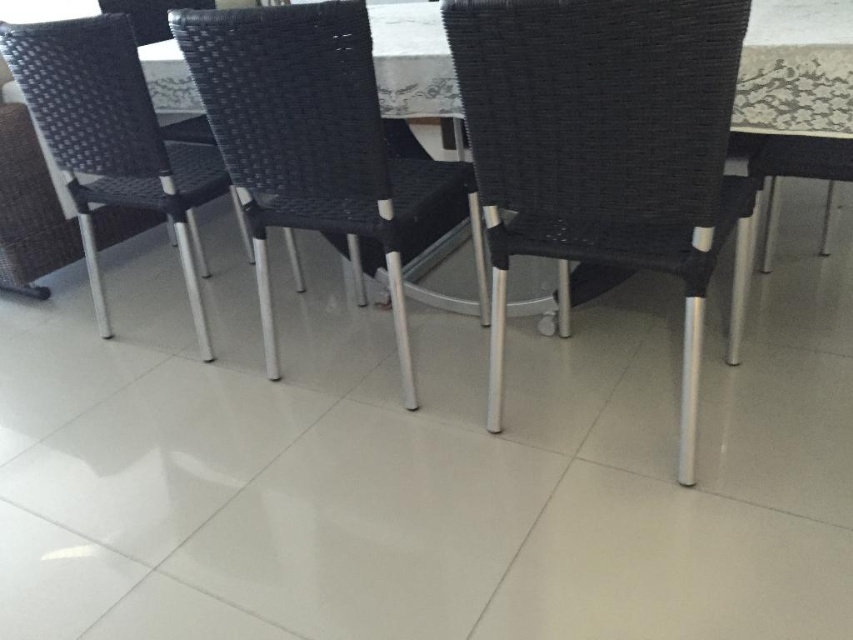
Question: Does matte black chair at center have a smaller size compared to black woven chair at upper right?

Choices:
 (A) yes
 (B) no

Answer: (B)

Question: Which of the following is the closest to the observer?

Choices:
 (A) (527, 76)
 (B) (846, 116)

Answer: (A)

Question: Can you confirm if black woven chair at center is positioned to the left of black woven chair at upper right?

Choices:
 (A) no
 (B) yes

Answer: (B)

Question: Which point is farther from the camera taking this photo?

Choices:
 (A) (785, 67)
 (B) (665, 99)
 (C) (195, 296)
 (D) (260, 29)

Answer: (C)

Question: Can you confirm if matte black chair at center is positioned to the left of black woven chair at center?

Choices:
 (A) no
 (B) yes

Answer: (A)

Question: Among these objects, which one is farthest from the camera?

Choices:
 (A) black woven chair at upper right
 (B) black woven chair at center

Answer: (B)